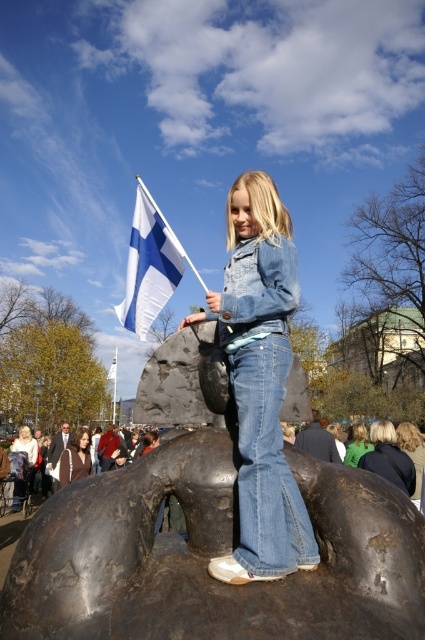
You are planning to take a photo of the bronze sculpture at center and the white fabric flag at upper left from a distance. Considering their heights, which object should you focus on first to ensure both are fully captured in the frame?

The bronze sculpture at center has a lesser height compared to the white fabric flag at upper left, so you should focus on the bronze sculpture at center first to ensure both are fully captured in the frame.

You are a photographer trying to capture the scene from the ground level. Which object, the denim jacket at center or the white fabric flag at upper left, is positioned higher in the frame?

The denim jacket at center is positioned higher in the frame than the white fabric flag at upper left.